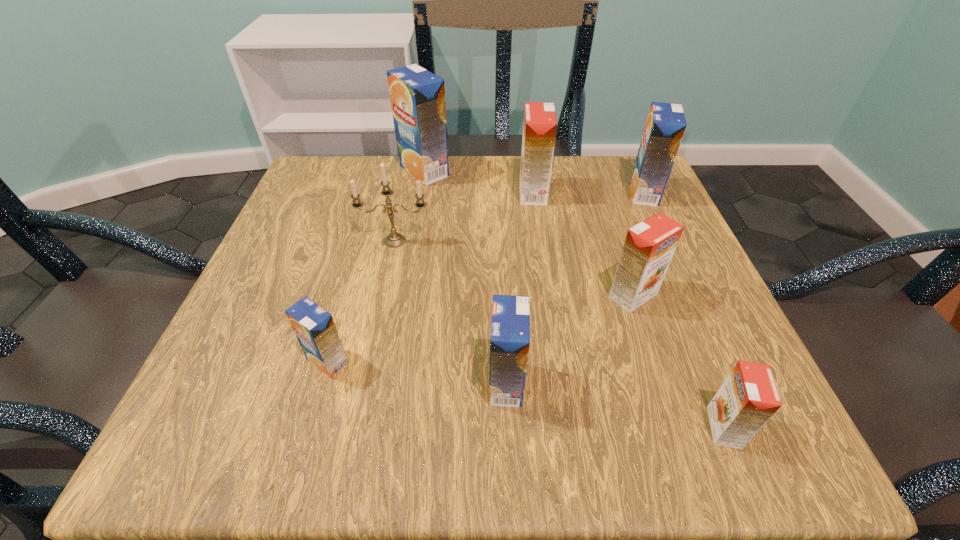
Where is `blank space at the far left corner of the desktop`? blank space at the far left corner of the desktop is located at coordinates (307, 209).

Locate an element on the screen. vacant region at the far right corner is located at coordinates (602, 182).

You are a GUI agent. You are given a task and a screenshot of the screen. Output one action in this format:
    pyautogui.click(x=<x>, y=<y>)
    Task: Click on the free space that is in between the farthest orange orange juice and the second biggest orange orange juice
    The image size is (960, 540).
    Given the screenshot: What is the action you would take?
    pyautogui.click(x=583, y=244)

The height and width of the screenshot is (540, 960). Find the location of `free space between the biggest blue orange_juice and the fourth object from left to right`. free space between the biggest blue orange_juice and the fourth object from left to right is located at coordinates (x=465, y=278).

At what (x,y) coordinates should I click in order to perform the action: click on unoccupied area between the metallic candle and the smallest blue orange_juice. Please return your answer as a coordinate pair (x, y). Looking at the image, I should click on [361, 301].

Identify the location of vacant area between the leftmost orange orange juice and the tallest object. (478, 182).

The height and width of the screenshot is (540, 960). Identify the location of vacant point located between the leftmost orange juice and the rightmost blue orange_juice. click(x=486, y=277).

Locate an element on the screen. This screenshot has height=540, width=960. empty location between the smallest orange orange juice and the smallest blue orange_juice is located at coordinates point(525,394).

Find the location of a particular element. This screenshot has width=960, height=540. free point between the third blue orange_juice from right to left and the leftmost orange orange juice is located at coordinates (478, 182).

You are a GUI agent. You are given a task and a screenshot of the screen. Output one action in this format:
    pyautogui.click(x=<x>, y=<y>)
    Task: Click on the free spot between the third smallest blue orange_juice and the fourth farthest object
    Image resolution: width=960 pixels, height=540 pixels.
    Given the screenshot: What is the action you would take?
    pyautogui.click(x=519, y=217)